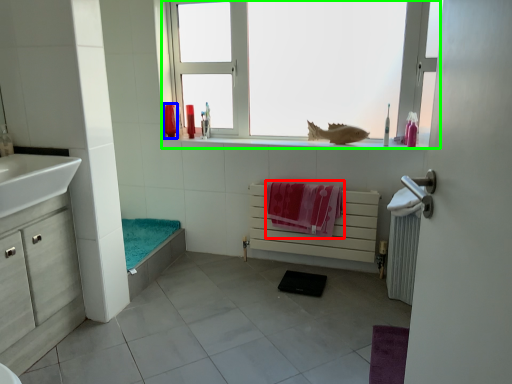
Question: Which is nearer to the beach towel (highlighted by a red box)? toiletry (highlighted by a blue box) or window (highlighted by a green box).

Choices:
 (A) toiletry
 (B) window

Answer: (B)